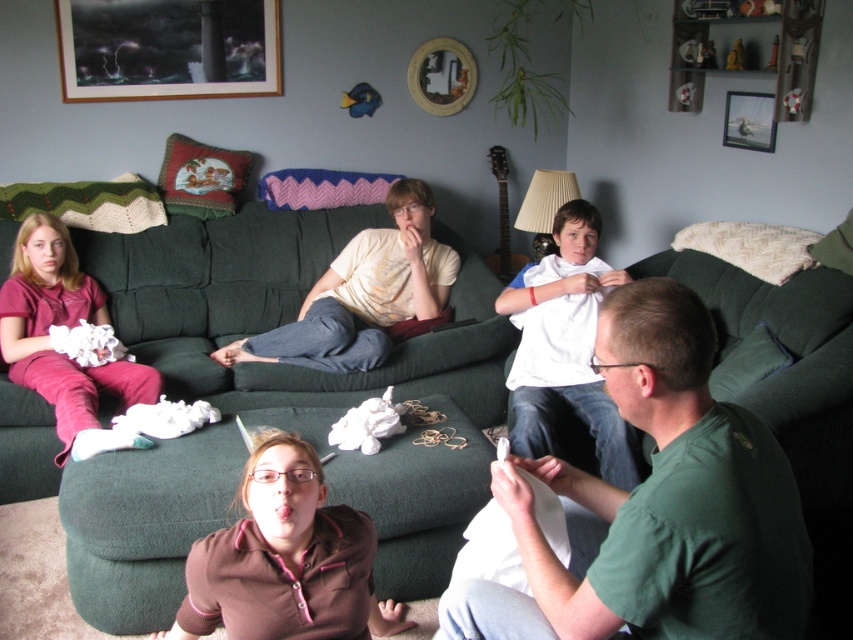
Question: Does light yellow t-shirt at center have a greater width compared to matte pink pants at left?

Choices:
 (A) no
 (B) yes

Answer: (B)

Question: Is the position of wooden framed artwork at upper left less distant than that of light yellow t-shirt at center?

Choices:
 (A) no
 (B) yes

Answer: (A)

Question: Estimate the real-world distances between objects in this image. Which object is farther from the matte pink pants at left?

Choices:
 (A) brown fleece at center
 (B) green fabric couch at center
 (C) green matte shirt at lower right
 (D) light yellow t-shirt at center

Answer: (C)

Question: Which of the following is the closest to the observer?

Choices:
 (A) (463, 490)
 (B) (190, 1)
 (C) (265, 612)
 (D) (740, 492)

Answer: (D)

Question: Does green fabric couch at center have a larger size compared to light yellow t-shirt at center?

Choices:
 (A) yes
 (B) no

Answer: (A)

Question: Based on their relative distances, which object is nearer to the matte pink pants at left?

Choices:
 (A) green fabric couch at center
 (B) green matte shirt at lower right

Answer: (A)